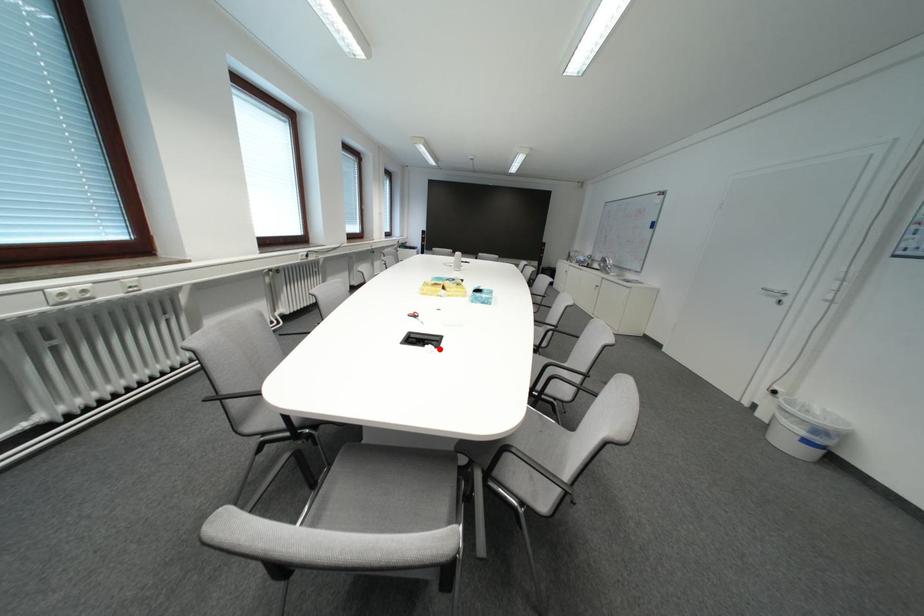
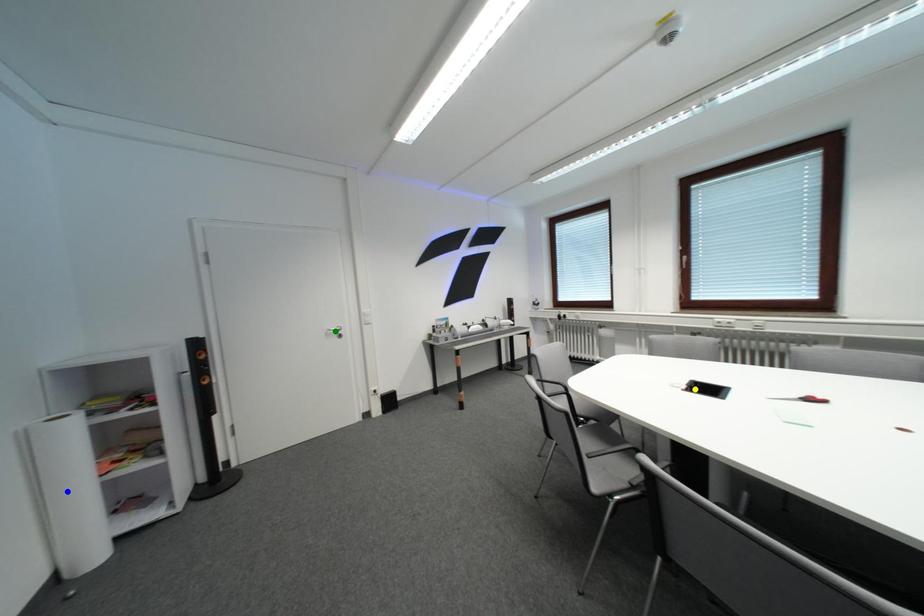
Question: I am providing you with two images of the same scene from different viewpoints. A red point is marked on the first image. You are given multiple points on the second image. Which spot in image 2 lines up with the point in image 1?

Choices:
 (A) blue point
 (B) yellow point
 (C) green point

Answer: (B)